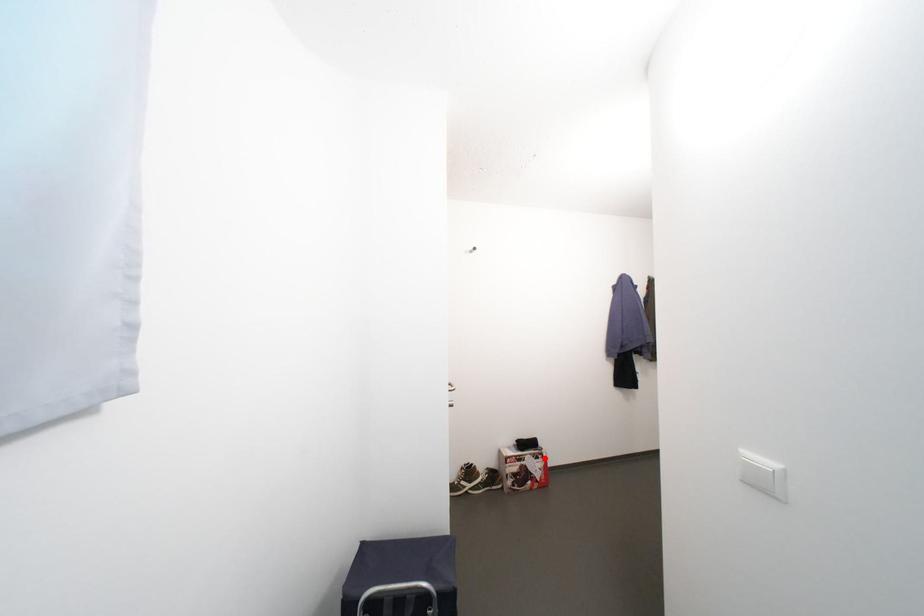
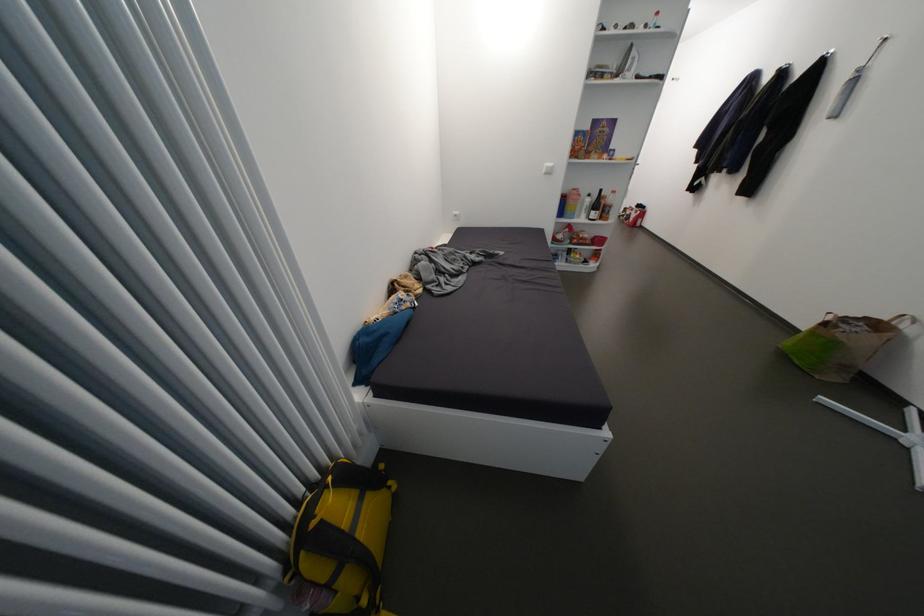
In the second image, find the point that corresponds to the highlighted location in the first image.

(642, 214)